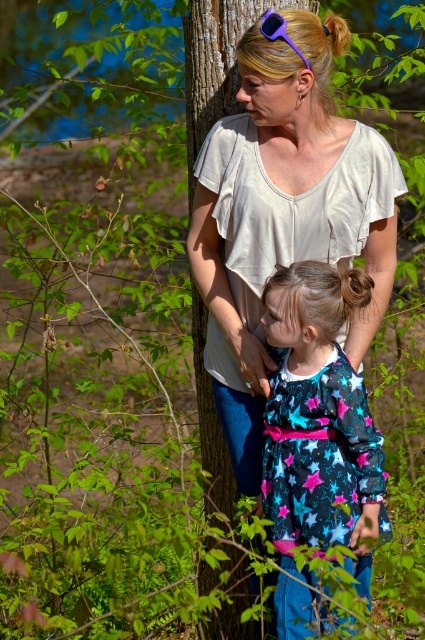
Question: Estimate the real-world distances between objects in this image. Which object is farther from the smooth brown tree trunk at center?

Choices:
 (A) shiny star-patterned dress at center
 (B) purple plastic goggles at upper center

Answer: (B)

Question: Which point is closer to the camera?

Choices:
 (A) (339, 353)
 (B) (190, 276)
 (C) (277, 26)

Answer: (C)

Question: Where is smooth brown tree trunk at center located in relation to purple plastic goggles at upper center in the image?

Choices:
 (A) below
 (B) above

Answer: (A)

Question: Which point is farther to the camera?

Choices:
 (A) (322, 403)
 (B) (294, 45)
 (C) (300, 4)

Answer: (C)

Question: From the image, what is the correct spatial relationship of shiny star-patterned dress at center in relation to smooth brown tree trunk at center?

Choices:
 (A) right
 (B) left

Answer: (A)

Question: Does shiny star-patterned dress at center appear on the right side of smooth brown tree trunk at center?

Choices:
 (A) yes
 (B) no

Answer: (A)